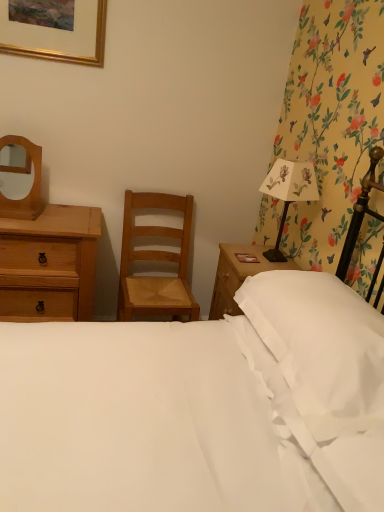
Question: From the image's perspective, is white smooth bed at center located above white soft pillow at right?

Choices:
 (A) no
 (B) yes

Answer: (B)

Question: Is white smooth bed at center facing towards white soft pillow at right?

Choices:
 (A) yes
 (B) no

Answer: (A)

Question: Does white smooth bed at center have a larger size compared to white soft pillow at right?

Choices:
 (A) yes
 (B) no

Answer: (A)

Question: Is white smooth bed at center to the left of white soft pillow at right from the viewer's perspective?

Choices:
 (A) no
 (B) yes

Answer: (B)

Question: Is white smooth bed at center to the right of white soft pillow at right from the viewer's perspective?

Choices:
 (A) yes
 (B) no

Answer: (B)

Question: Is matte wooden mirror at upper left taller or shorter than light brown wood chair at center?

Choices:
 (A) tall
 (B) short

Answer: (B)

Question: In the image, is matte wooden mirror at upper left on the left side or the right side of light brown wood chair at center?

Choices:
 (A) left
 (B) right

Answer: (A)

Question: Would you say matte wooden mirror at upper left is inside or outside light brown wood chair at center?

Choices:
 (A) inside
 (B) outside

Answer: (B)

Question: From the image's perspective, is matte wooden mirror at upper left above or below light brown wood chair at center?

Choices:
 (A) above
 (B) below

Answer: (A)

Question: Would you say gold metallic picture frame at upper left is to the left or to the right of white soft pillow at right in the picture?

Choices:
 (A) left
 (B) right

Answer: (A)

Question: Do you think gold metallic picture frame at upper left is within white soft pillow at right, or outside of it?

Choices:
 (A) inside
 (B) outside

Answer: (B)

Question: Looking at the image, does gold metallic picture frame at upper left seem bigger or smaller compared to white soft pillow at right?

Choices:
 (A) big
 (B) small

Answer: (B)

Question: Is gold metallic picture frame at upper left taller or shorter than white soft pillow at right?

Choices:
 (A) short
 (B) tall

Answer: (B)

Question: Looking at their shapes, would you say white paper lampshade at right is wider or thinner than matte wooden mirror at upper left?

Choices:
 (A) wide
 (B) thin

Answer: (A)

Question: Considering their positions, is white paper lampshade at right located in front of or behind matte wooden mirror at upper left?

Choices:
 (A) behind
 (B) front

Answer: (B)